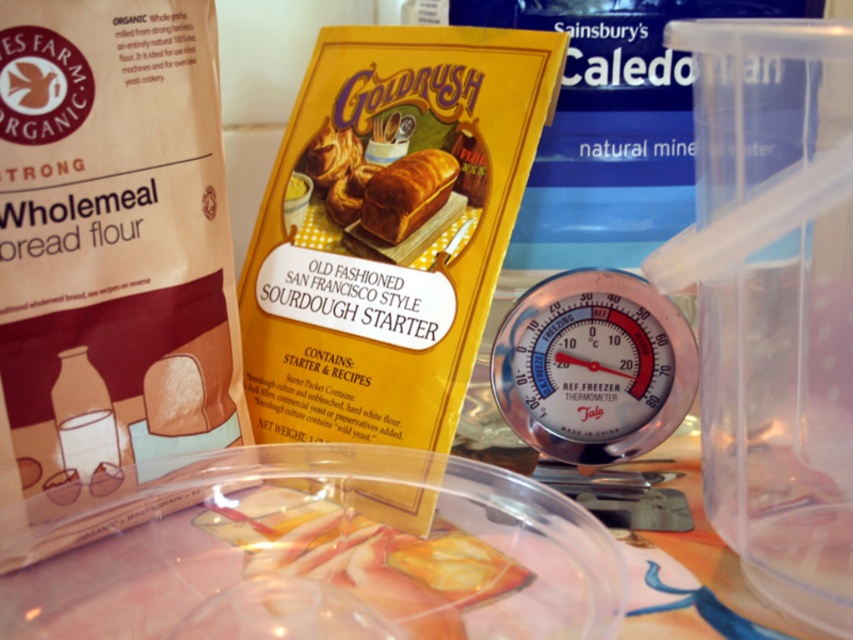
Question: Is transparent plastic thermometer at center positioned in front of golden crusty loaf of bread at center?

Choices:
 (A) yes
 (B) no

Answer: (A)

Question: Does transparent plastic thermometer at center have a smaller size compared to golden crusty loaf of bread at center?

Choices:
 (A) no
 (B) yes

Answer: (A)

Question: Is transparent plastic thermometer at center positioned before golden crusty loaf of bread at center?

Choices:
 (A) yes
 (B) no

Answer: (A)